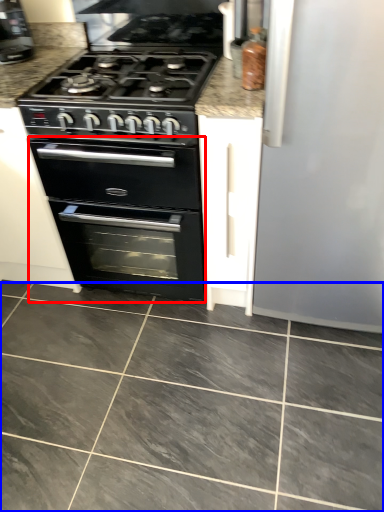
Question: Which object appears closest to the camera in this image, oven (highlighted by a red box) or ceramic tile (highlighted by a blue box)?

Choices:
 (A) oven
 (B) ceramic tile

Answer: (B)